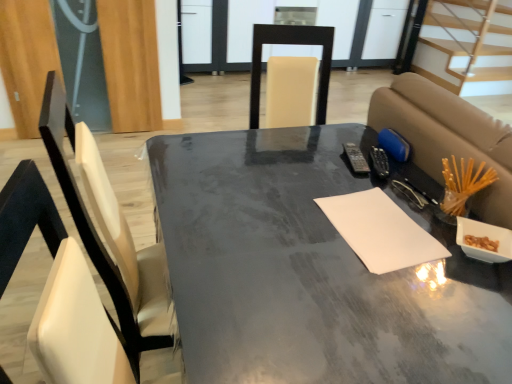
Locate an element on the screen. vacant space in front of white paper at center is located at coordinates (399, 304).